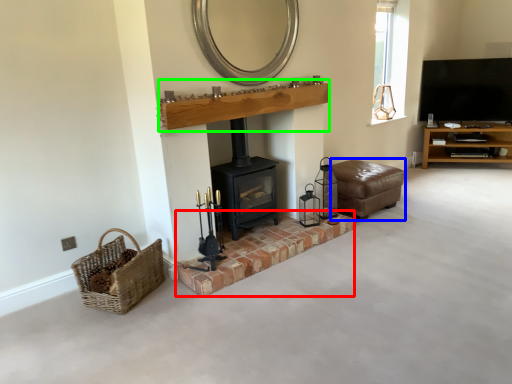
Question: Which is farther away from brickwork (highlighted by a red box)? armchair (highlighted by a blue box) or mantle (highlighted by a green box)?

Choices:
 (A) armchair
 (B) mantle

Answer: (B)